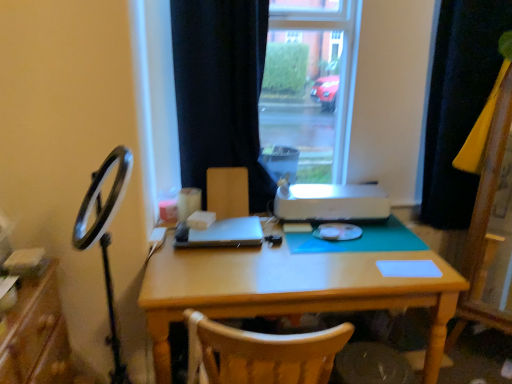
I want to click on vacant space underneath white matte notepad at center (from a real-world perspective), so click(x=410, y=268).